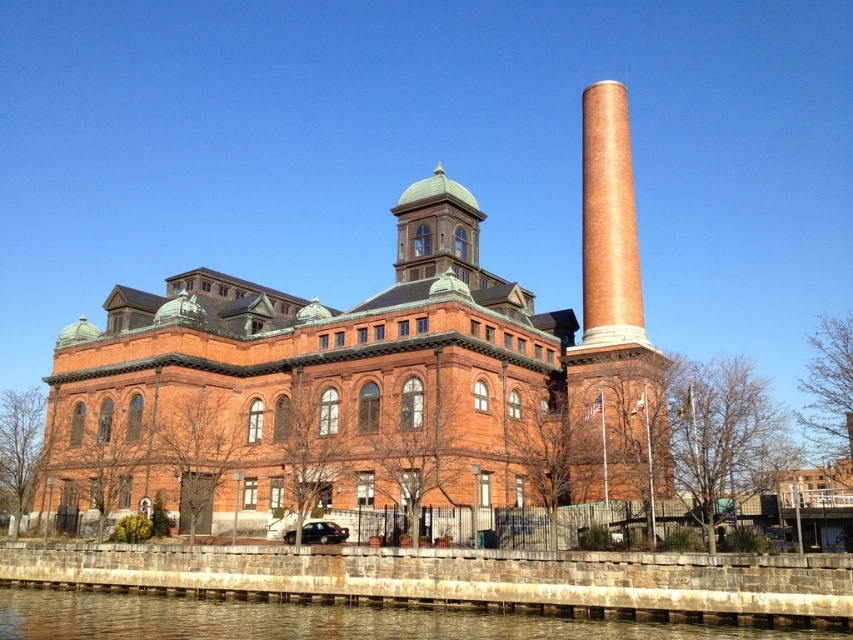
From the picture: Is brick chimney at right thinner than brown stone wall at lower left?

Yes.

Can you confirm if brick chimney at right is positioned below brown stone wall at lower left?

No.

Find the location of a particular element. The image size is (853, 640). brick chimney at right is located at coordinates (616, 307).